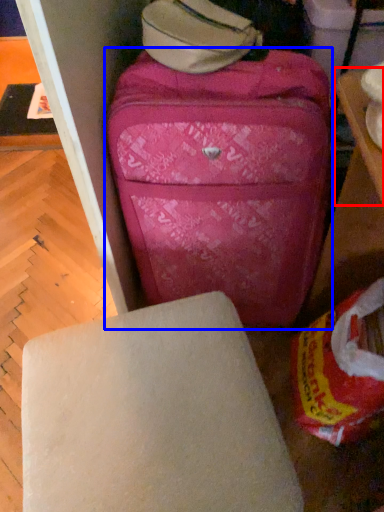
Question: Among these objects, which one is nearest to the camera, table (highlighted by a red box) or suitcase (highlighted by a blue box)?

Choices:
 (A) table
 (B) suitcase

Answer: (A)